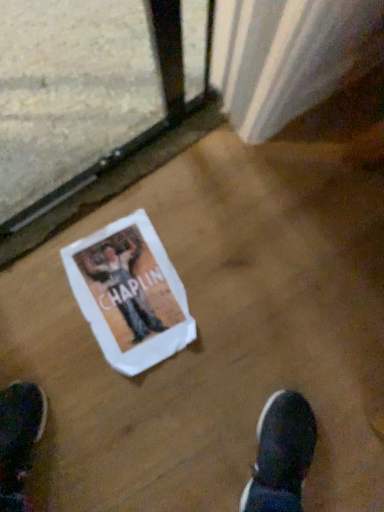
The image size is (384, 512). What are the coordinates of `free area behind white paper flyer at center` in the screenshot? It's located at (147, 193).